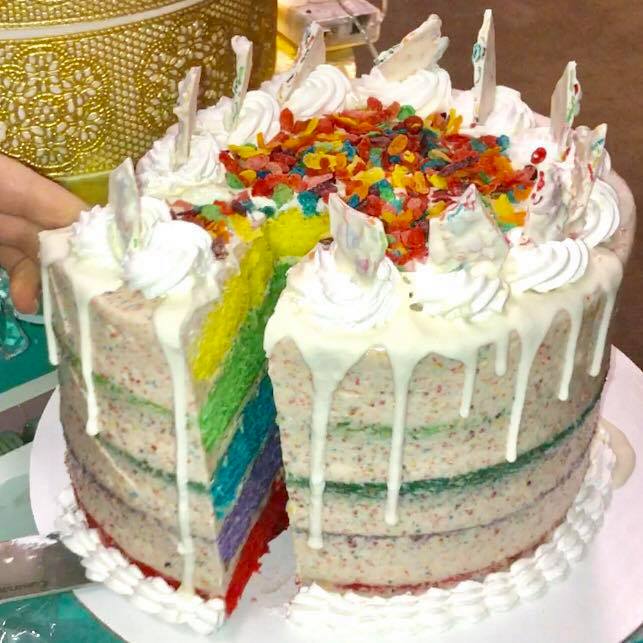
The image size is (643, 643). In order to click on floor in this screenshot , I will do `click(620, 68)`.